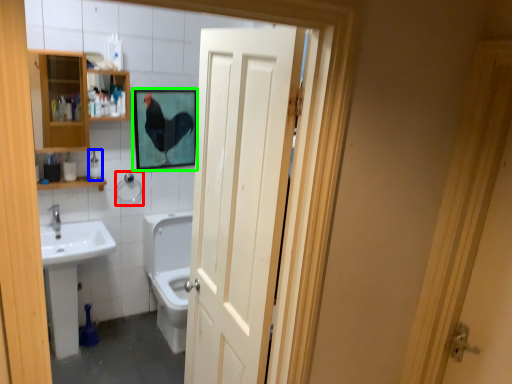
Question: Estimate the real-world distances between objects in this image. Which object is closer to towel bar (highlighted by a red box), toiletry (highlighted by a blue box) or picture frame (highlighted by a green box)?

Choices:
 (A) toiletry
 (B) picture frame

Answer: (A)